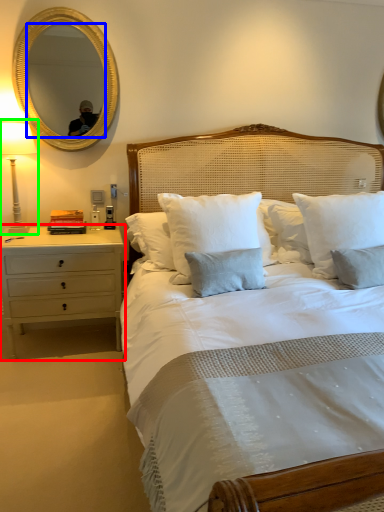
Question: Which object is the closest to the nightstand (highlighted by a red box)? Choose among these: mirror (highlighted by a blue box) or bedside lamp (highlighted by a green box).

Choices:
 (A) mirror
 (B) bedside lamp

Answer: (B)